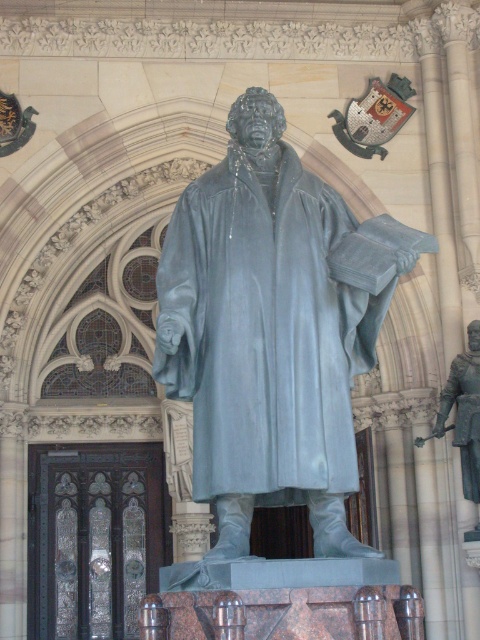
Question: Is matte gray statue at center closer to camera compared to polished bronze knight at right?

Choices:
 (A) no
 (B) yes

Answer: (B)

Question: Is matte gray statue at center wider than polished bronze knight at right?

Choices:
 (A) yes
 (B) no

Answer: (A)

Question: Which point appears farthest from the camera in this image?

Choices:
 (A) (307, 188)
 (B) (459, 404)

Answer: (B)

Question: Does matte gray statue at center have a smaller size compared to polished bronze knight at right?

Choices:
 (A) yes
 (B) no

Answer: (B)

Question: Which of the following is the farthest from the observer?

Choices:
 (A) matte gray statue at center
 (B) polished bronze knight at right

Answer: (B)

Question: Which point is closer to the camera taking this photo?

Choices:
 (A) (456, 364)
 (B) (278, 252)

Answer: (B)